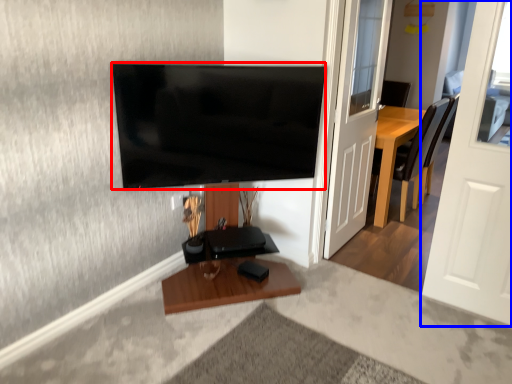
Question: Which point is closer to the camera, television (highlighted by a red box) or door (highlighted by a blue box)?

Choices:
 (A) television
 (B) door

Answer: (B)